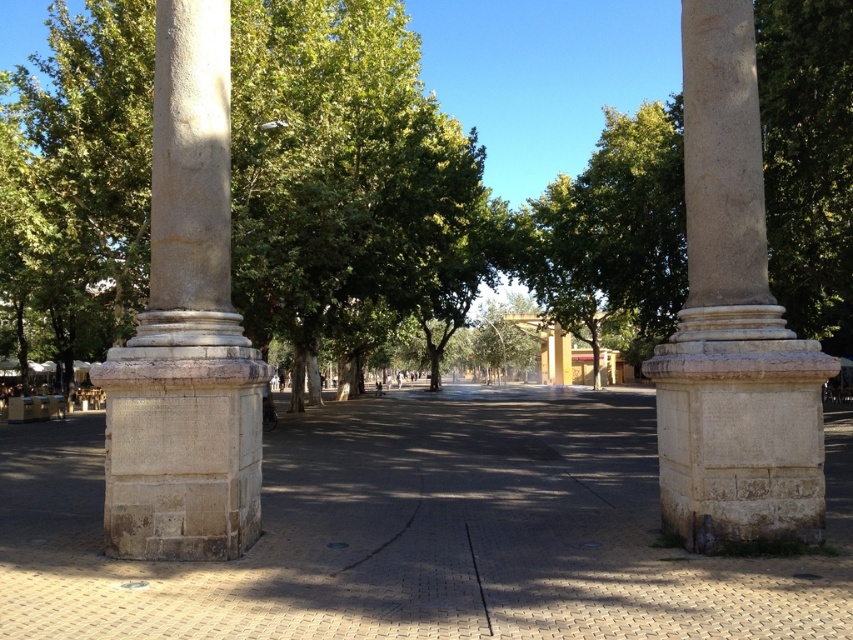
Question: Which point appears closest to the camera in this image?

Choices:
 (A) (460, 230)
 (B) (705, 300)
 (C) (611, 506)
 (D) (468, 525)

Answer: (B)

Question: Which object is closer to the camera taking this photo?

Choices:
 (A) beige stone column at right
 (B) smooth stone pavement at center

Answer: (B)

Question: Which of the following is the farthest from the observer?

Choices:
 (A) black glossy line at center
 (B) beige stone column at right
 (C) green leafy tree at center
 (D) smooth stone pavement at center

Answer: (C)

Question: Is green leafy tree at center to the left of black matte line at center from the viewer's perspective?

Choices:
 (A) no
 (B) yes

Answer: (B)

Question: Can you confirm if green leafy tree at center is wider than black glossy line at center?

Choices:
 (A) no
 (B) yes

Answer: (B)

Question: Does smooth stone pavement at center have a smaller size compared to black matte line at center?

Choices:
 (A) yes
 (B) no

Answer: (B)